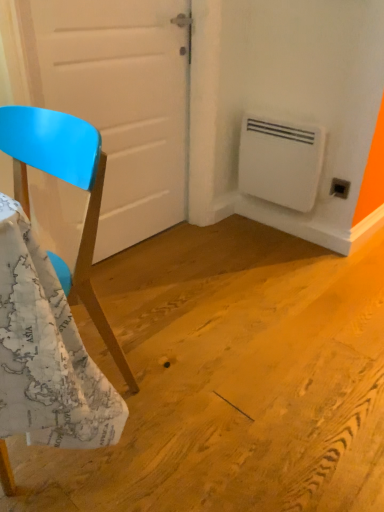
Question: Does black plastic electric outlet at lower right turn towards white plastic air conditioning unit at lower right?

Choices:
 (A) yes
 (B) no

Answer: (B)

Question: From a real-world perspective, is black plastic electric outlet at lower right beneath white plastic air conditioning unit at lower right?

Choices:
 (A) yes
 (B) no

Answer: (A)

Question: Is black plastic electric outlet at lower right to the left of white plastic air conditioning unit at lower right from the viewer's perspective?

Choices:
 (A) yes
 (B) no

Answer: (B)

Question: Is black plastic electric outlet at lower right to the right of white plastic air conditioning unit at lower right from the viewer's perspective?

Choices:
 (A) yes
 (B) no

Answer: (A)

Question: Would you say white plastic air conditioning unit at lower right is part of black plastic electric outlet at lower right's contents?

Choices:
 (A) no
 (B) yes

Answer: (A)

Question: From a real-world perspective, is white plastic air conditioning unit at lower right physically located above or below white matte door at center?

Choices:
 (A) above
 (B) below

Answer: (B)

Question: Looking at their shapes, would you say white plastic air conditioning unit at lower right is wider or thinner than white matte door at center?

Choices:
 (A) wide
 (B) thin

Answer: (B)

Question: Visually, is white plastic air conditioning unit at lower right positioned to the left or to the right of white matte door at center?

Choices:
 (A) right
 (B) left

Answer: (A)

Question: From their relative heights in the image, would you say white plastic air conditioning unit at lower right is taller or shorter than white matte door at center?

Choices:
 (A) short
 (B) tall

Answer: (A)

Question: Is point (178, 53) closer or farther from the camera than point (1, 449)?

Choices:
 (A) closer
 (B) farther

Answer: (B)

Question: Considering the positions of white matte door at center and matte blue chair at left in the image, is white matte door at center wider or thinner than matte blue chair at left?

Choices:
 (A) thin
 (B) wide

Answer: (A)

Question: Is white matte door at center in front of or behind matte blue chair at left in the image?

Choices:
 (A) front
 (B) behind

Answer: (B)

Question: From a real-world perspective, is white matte door at center physically located above or below matte blue chair at left?

Choices:
 (A) below
 (B) above

Answer: (B)

Question: From the image's perspective, relative to white plastic air conditioning unit at lower right, is matte blue chair at left above or below?

Choices:
 (A) above
 (B) below

Answer: (B)

Question: Is matte blue chair at left spatially inside white plastic air conditioning unit at lower right, or outside of it?

Choices:
 (A) inside
 (B) outside

Answer: (B)